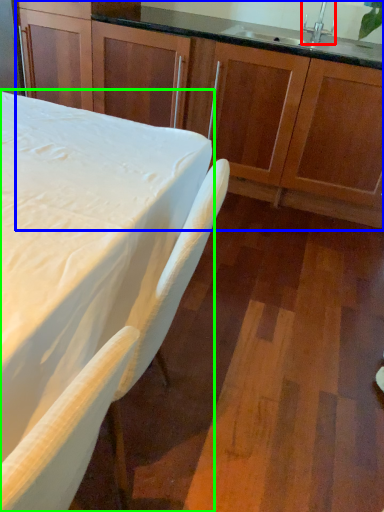
Question: Considering the real-world distances, which object is closest to faucet (highlighted by a red box)? cabinetry (highlighted by a blue box) or table (highlighted by a green box).

Choices:
 (A) cabinetry
 (B) table

Answer: (A)